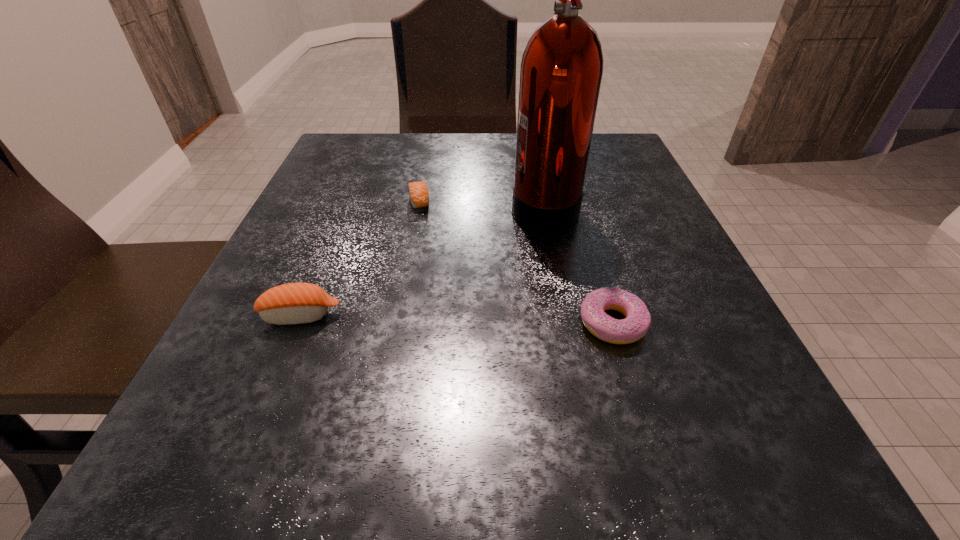
Locate an element on the screen. This screenshot has height=540, width=960. vacant region located on the left of the doughnut is located at coordinates (538, 323).

The width and height of the screenshot is (960, 540). In order to click on vacant space located on the front of the farther sushi in this screenshot , I will do `click(385, 386)`.

Where is `object present at the far edge`? This screenshot has width=960, height=540. object present at the far edge is located at coordinates (562, 66).

Image resolution: width=960 pixels, height=540 pixels. Find the location of `object present at the left edge`. object present at the left edge is located at coordinates (295, 303).

Find the location of a particular element. This screenshot has height=540, width=960. fire extinguisher present at the right edge is located at coordinates (562, 66).

At what (x,y) coordinates should I click in order to perform the action: click on doughnut present at the right edge. Please return your answer as a coordinate pair (x, y). Looking at the image, I should click on pyautogui.click(x=638, y=319).

Find the location of `object situated at the far right corner`. object situated at the far right corner is located at coordinates (562, 66).

Identify the location of free space at the far edge of the desktop. (486, 145).

Where is `vacant space at the near edge of the desktop`? This screenshot has height=540, width=960. vacant space at the near edge of the desktop is located at coordinates (365, 472).

In the image, there is a desktop. What are the coordinates of `free space at the left edge` in the screenshot? It's located at (231, 410).